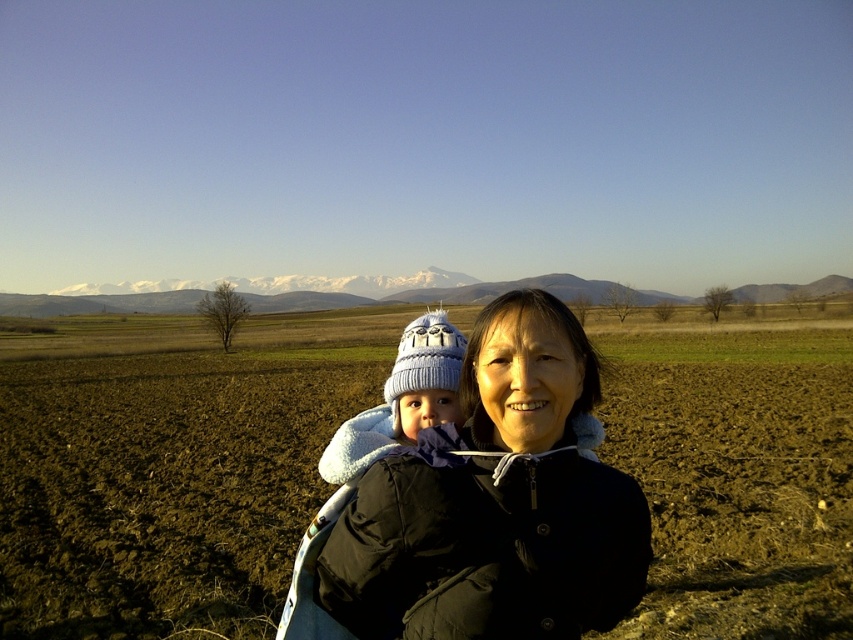
You are planning to plant a small garden in the brown soil at center. Considering the size of the black fleece jacket at center, which object occupies more space in the scene?

The brown soil at center occupies more space than the black fleece jacket at center, as it is described as having a larger size.

You are a photographer trying to capture a shot of the brown soil at center and the black fleece jacket at center. Based on their positions, which object should you focus on first if you want to frame them both in a single shot?

The brown soil at center is positioned on the left side of black fleece jacket at center, so you should focus on the brown soil at center first to ensure both objects are included in the frame.